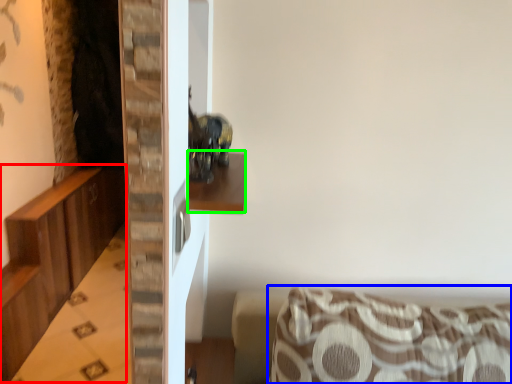
Question: Based on their relative distances, which object is farther from dresser (highlighted by a red box)? Choose from furniture (highlighted by a blue box) and shelf (highlighted by a green box).

Choices:
 (A) furniture
 (B) shelf

Answer: (B)